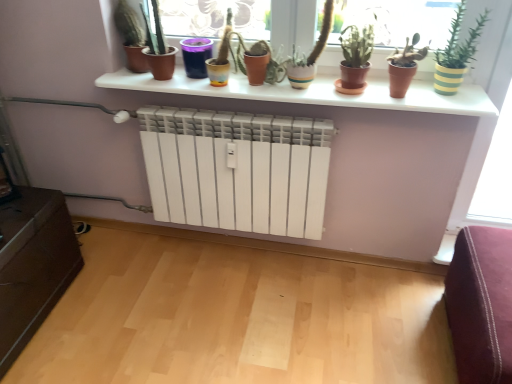
Question: In which direction should I rotate to look at green matte plant at center, placed as the third houseplant when sorted from right to left?

Choices:
 (A) right
 (B) left

Answer: (A)

Question: Does matte black pot at upper left, which appears as the 1th houseplant when viewed from the left, touch matte yellow pot at center?

Choices:
 (A) no
 (B) yes

Answer: (A)

Question: Is matte black pot at upper left, acting as the 5th houseplant starting from the right, at the left side of matte yellow pot at center?

Choices:
 (A) no
 (B) yes

Answer: (B)

Question: Does matte black pot at upper left, which appears as the 1th houseplant when viewed from the left, lie behind matte yellow pot at center?

Choices:
 (A) yes
 (B) no

Answer: (A)

Question: Is matte yellow pot at center a part of matte black pot at upper left, which appears as the 1th houseplant when viewed from the left?

Choices:
 (A) yes
 (B) no

Answer: (B)

Question: Can you confirm if matte black pot at upper left, which appears as the 1th houseplant when viewed from the left, is thinner than matte yellow pot at center?

Choices:
 (A) no
 (B) yes

Answer: (B)

Question: Does matte black pot at upper left, acting as the 5th houseplant starting from the right, have a lesser height compared to matte yellow pot at center?

Choices:
 (A) yes
 (B) no

Answer: (B)

Question: Is white matte shelf at upper center to the right of green matte cactus at upper left, arranged as the 4th houseplant when viewed from the right, from the viewer's perspective?

Choices:
 (A) no
 (B) yes

Answer: (B)

Question: Is the depth of white matte shelf at upper center greater than that of green matte cactus at upper left, positioned as the 2th houseplant in left-to-right order?

Choices:
 (A) yes
 (B) no

Answer: (B)

Question: Is white matte shelf at upper center to the left of green matte cactus at upper left, positioned as the 2th houseplant in left-to-right order, from the viewer's perspective?

Choices:
 (A) yes
 (B) no

Answer: (B)

Question: Is white matte shelf at upper center turned away from green matte cactus at upper left, positioned as the 2th houseplant in left-to-right order?

Choices:
 (A) yes
 (B) no

Answer: (B)

Question: Can you confirm if white matte shelf at upper center is shorter than green matte cactus at upper left, positioned as the 2th houseplant in left-to-right order?

Choices:
 (A) yes
 (B) no

Answer: (A)

Question: Is white matte shelf at upper center facing towards green matte cactus at upper left, arranged as the 4th houseplant when viewed from the right?

Choices:
 (A) yes
 (B) no

Answer: (B)

Question: Are terracotta clay pot at center, positioned as the 2th houseplant in right-to-left order, and yellow-green striped pot at upper right, the 5th houseplant positioned from the left, beside each other?

Choices:
 (A) no
 (B) yes

Answer: (A)